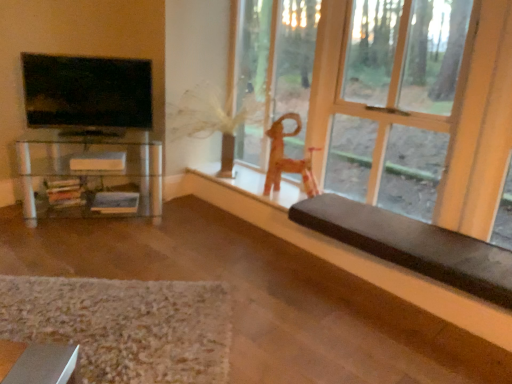
Measure the distance between wooden chair at right and camera.

A distance of 1.84 meters exists between wooden chair at right and camera.

The height and width of the screenshot is (384, 512). What do you see at coordinates (422, 119) in the screenshot? I see `wooden chair at right` at bounding box center [422, 119].

Image resolution: width=512 pixels, height=384 pixels. Describe the element at coordinates (345, 251) in the screenshot. I see `brown cushioned bench at lower right` at that location.

You are a GUI agent. You are given a task and a screenshot of the screen. Output one action in this format:
    pyautogui.click(x=<x>, y=<y>)
    Task: Click on the brown cushioned bench at lower right
    The height and width of the screenshot is (384, 512).
    Given the screenshot: What is the action you would take?
    pyautogui.click(x=345, y=251)

This screenshot has height=384, width=512. I want to click on textured beige rug at lower left, so click(x=125, y=326).

Describe the element at coordinates (412, 245) in the screenshot. I see `black leather bench at lower right` at that location.

This screenshot has height=384, width=512. What do you see at coordinates (87, 95) in the screenshot?
I see `matte black tv at left` at bounding box center [87, 95].

The height and width of the screenshot is (384, 512). What are the coordinates of `wooden chair at right` in the screenshot? It's located at (422, 119).

Is wooden chair at right looking in the opposite direction of brown cushioned bench at lower right?

No, wooden chair at right's orientation is not away from brown cushioned bench at lower right.

How distant is wooden chair at right from brown cushioned bench at lower right?

wooden chair at right and brown cushioned bench at lower right are 71.54 centimeters apart from each other.

From the image's perspective, which is below, wooden chair at right or brown cushioned bench at lower right?

brown cushioned bench at lower right is shown below in the image.

Does wooden chair at right appear on the right side of brown cushioned bench at lower right?

Indeed, wooden chair at right is positioned on the right side of brown cushioned bench at lower right.

Between matte black tv at left and clear glass shelf at left, which one has larger width?

Wider between the two is clear glass shelf at left.

Which object is more forward, matte black tv at left or clear glass shelf at left?

matte black tv at left.

Identify the location of shelf that is below the matte black tv at left (from the image's perspective). (91, 170).

How many degrees apart are the facing directions of matte black tv at left and clear glass shelf at left?

The angle between the facing direction of matte black tv at left and the facing direction of clear glass shelf at left is 0.215 degrees.

Which is correct: black leather bench at lower right is inside wooden toy horse at center, or outside of it?

The correct answer is: outside.

Is black leather bench at lower right placed right next to wooden toy horse at center?

No, black leather bench at lower right is not beside wooden toy horse at center.

From the image's perspective, would you say black leather bench at lower right is positioned over wooden toy horse at center?

Actually, black leather bench at lower right appears below wooden toy horse at center in the image.

Can you confirm if black leather bench at lower right is shorter than wooden toy horse at center?

Indeed, black leather bench at lower right has a lesser height compared to wooden toy horse at center.

Based on the photo, which of these two, brown cushioned bench at lower right or black leather bench at lower right, is bigger?

Bigger between the two is black leather bench at lower right.

Which point is more distant from viewer, [276,196] or [450,252]?

The point [276,196] is farther.

From the image's perspective, which is above, brown cushioned bench at lower right or black leather bench at lower right?

black leather bench at lower right.

Is brown cushioned bench at lower right spatially inside black leather bench at lower right, or outside of it?

brown cushioned bench at lower right is outside black leather bench at lower right.

Considering the positions of points (278, 121) and (327, 242), is point (278, 121) closer to camera compared to point (327, 242)?

No, (278, 121) is further to viewer.

Which object is wider, wooden toy horse at center or brown cushioned bench at lower right?

With larger width is wooden toy horse at center.

Is wooden toy horse at center facing towards brown cushioned bench at lower right?

No.

Can you see wooden toy horse at center touching brown cushioned bench at lower right?

No, wooden toy horse at center is not beside brown cushioned bench at lower right.

Who is smaller, textured beige rug at lower left or black leather bench at lower right?

With smaller size is textured beige rug at lower left.

What's the angular difference between textured beige rug at lower left and black leather bench at lower right's facing directions?

textured beige rug at lower left and black leather bench at lower right are facing 136 degrees away from each other.

Is textured beige rug at lower left facing away from black leather bench at lower right?

No, black leather bench at lower right is not at the back of textured beige rug at lower left.

Does brown cushioned bench at lower right appear on the left side of wooden toy horse at center?

No.

Between brown cushioned bench at lower right and wooden toy horse at center, which one has smaller width?

brown cushioned bench at lower right.

How many degrees apart are the facing directions of brown cushioned bench at lower right and wooden toy horse at center?

They differ by 25.2 degrees in their facing directions.

This screenshot has width=512, height=384. In the image, there is a brown cushioned bench at lower right. Identify the location of window above it (from the image's perspective). (422, 119).

Image resolution: width=512 pixels, height=384 pixels. I want to click on shelf on the left of matte black tv at left, so click(x=91, y=170).

From the image, which object appears to be nearer to textured beige rug at lower left, wooden toy horse at center or clear glass shelf at left?

Among the two, clear glass shelf at left is located nearer to textured beige rug at lower left.

When comparing their distances from textured beige rug at lower left, does brown cushioned bench at lower right or matte black tv at left seem closer?

brown cushioned bench at lower right is positioned closer to the anchor textured beige rug at lower left.

In the scene shown: When comparing their distances from clear glass shelf at left, does wooden toy horse at center or wooden chair at right seem further?

Among the two, wooden chair at right is located further to clear glass shelf at left.

From the image, which object appears to be nearer to matte black tv at left, black leather bench at lower right or brown cushioned bench at lower right?

Based on the image, brown cushioned bench at lower right appears to be nearer to matte black tv at left.

Considering their positions, is wooden toy horse at center positioned further to wooden chair at right than matte black tv at left?

The object further to wooden chair at right is matte black tv at left.

When comparing their distances from wooden chair at right, does black leather bench at lower right or wooden toy horse at center seem further?

black leather bench at lower right.

From the image, which object appears to be farther from clear glass shelf at left, black leather bench at lower right or brown cushioned bench at lower right?

black leather bench at lower right lies further to clear glass shelf at left than the other object.

Estimate the real-world distances between objects in this image. Which object is further from wooden toy horse at center, black leather bench at lower right or matte black tv at left?

matte black tv at left.

Find the location of `ledge between clear glass shelf at left and wooden chair at right`. ledge between clear glass shelf at left and wooden chair at right is located at coordinates (345, 251).

Locate an element on the screen. This screenshot has width=512, height=384. ledge between black leather bench at lower right and wooden toy horse at center from front to back is located at coordinates point(345,251).

Find the location of `window between black leather bench at lower right and wooden toy horse at center in the front-back direction`. window between black leather bench at lower right and wooden toy horse at center in the front-back direction is located at coordinates (422, 119).

The height and width of the screenshot is (384, 512). What are the coordinates of `toy situated between matte black tv at left and wooden chair at right from left to right` in the screenshot? It's located at (288, 159).